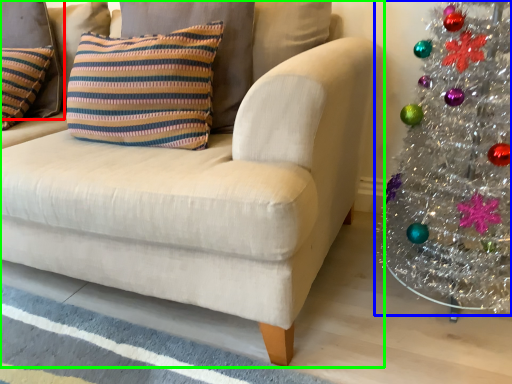
Question: Which object is positioned farthest from pillow (highlighted by a red box)? Select from christmas tree (highlighted by a blue box) and studio couch (highlighted by a green box).

Choices:
 (A) christmas tree
 (B) studio couch

Answer: (A)